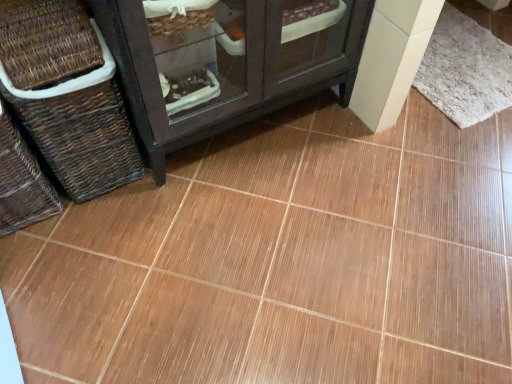
Locate an element on the screen. This screenshot has height=384, width=512. vacant area located to the right-hand side of brown woven basket at left, the first basket in the left-to-right sequence is located at coordinates (108, 222).